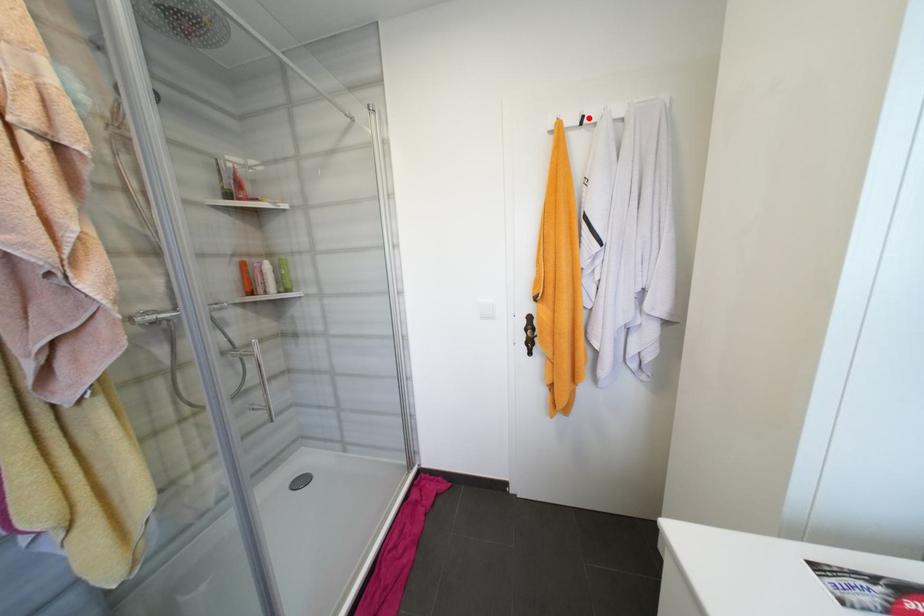
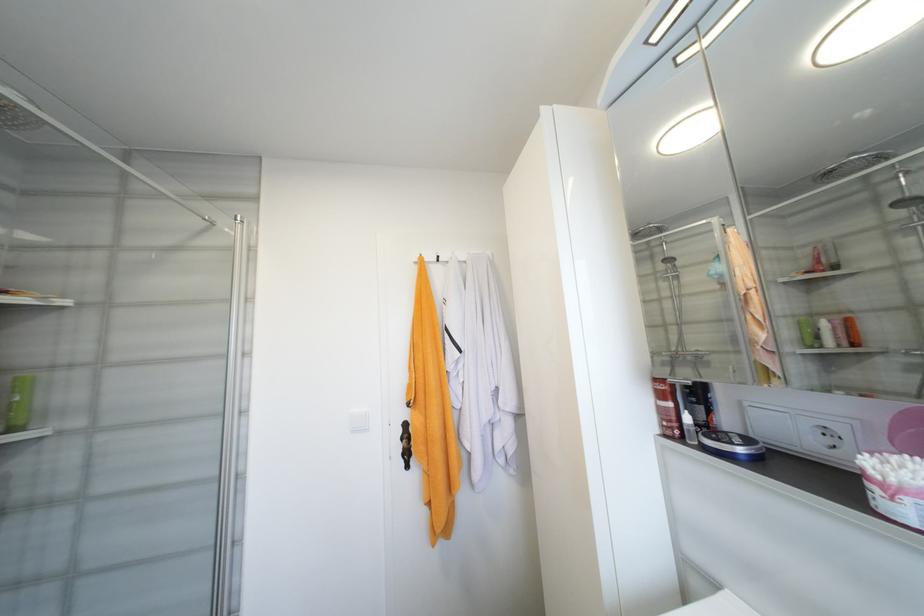
Locate, in the second image, the point that corresponds to the highlighted location in the first image.

(444, 257)